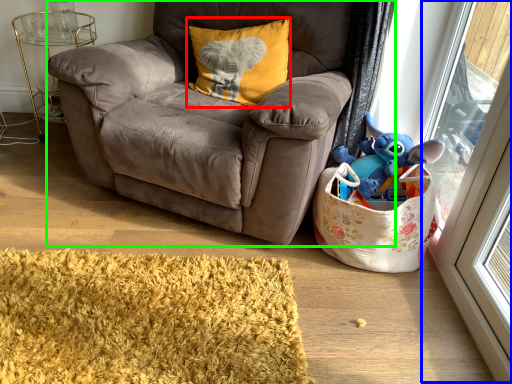
Question: Which object is positioned farthest from pillow (highlighted by a red box)? Select from screen door (highlighted by a blue box) and chair (highlighted by a green box).

Choices:
 (A) screen door
 (B) chair

Answer: (A)